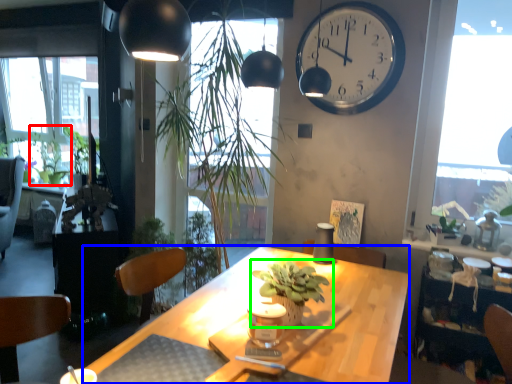
Question: Estimate the real-world distances between objects in this image. Which object is farther from plant (highlighted by a red box), desk (highlighted by a blue box) or houseplant (highlighted by a green box)?

Choices:
 (A) desk
 (B) houseplant

Answer: (B)